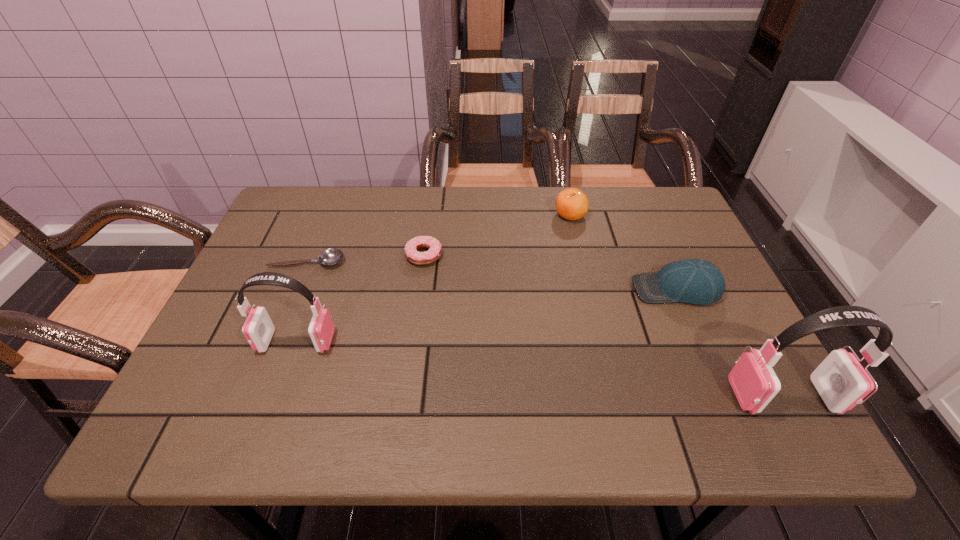
Image resolution: width=960 pixels, height=540 pixels. I want to click on vacant point located on the outer surface of the left earphone, so click(x=237, y=341).

Where is `free space located on the right of the fourth object from left to right`? Image resolution: width=960 pixels, height=540 pixels. free space located on the right of the fourth object from left to right is located at coordinates (628, 215).

The height and width of the screenshot is (540, 960). What are the coordinates of `free space located 0.190m on the left of the fourth farthest object` in the screenshot? It's located at (555, 289).

Identify the location of vacant space located 0.120m on the left of the doughnut. This screenshot has height=540, width=960. (360, 255).

I want to click on vacant area located 0.060m on the right of the ladle, so click(x=368, y=261).

Where is `object located at the far edge`? This screenshot has width=960, height=540. object located at the far edge is located at coordinates (572, 204).

The height and width of the screenshot is (540, 960). Find the location of `object at the near edge`. object at the near edge is located at coordinates (841, 381).

Where is `earphone that is at the left edge`? Image resolution: width=960 pixels, height=540 pixels. earphone that is at the left edge is located at coordinates (258, 329).

Find the location of a particular element. The height and width of the screenshot is (540, 960). ladle present at the left edge is located at coordinates (332, 256).

The height and width of the screenshot is (540, 960). Identify the location of earphone that is positioned at the right edge. (841, 381).